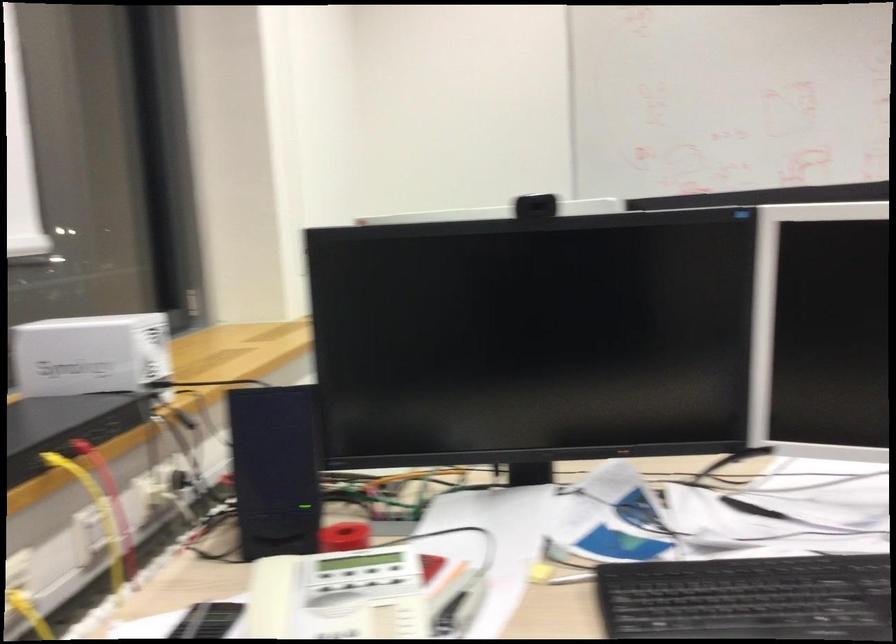
This screenshot has height=644, width=896. What do you see at coordinates (352, 581) in the screenshot?
I see `a telephone button` at bounding box center [352, 581].